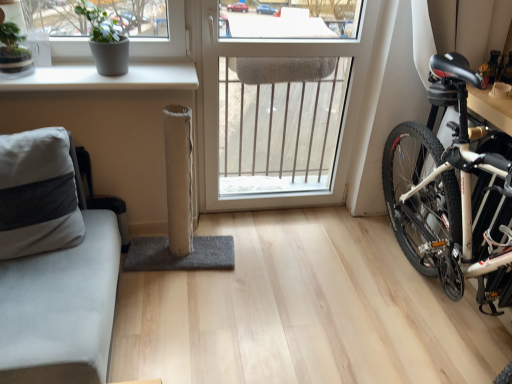
Locate an element on the screen. The width and height of the screenshot is (512, 384). free spot below white plastic window at center (from a real-world perspective) is located at coordinates (273, 215).